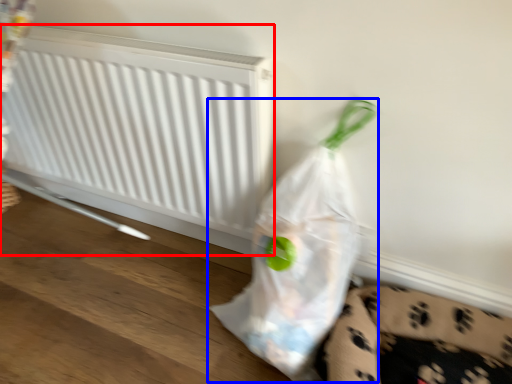
Question: Among these objects, which one is farthest to the camera, radiator (highlighted by a red box) or plastic bag (highlighted by a blue box)?

Choices:
 (A) radiator
 (B) plastic bag

Answer: (A)